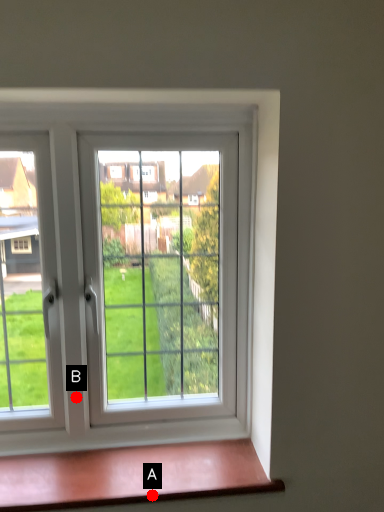
Question: Two points are circled on the image, labeled by A and B beside each circle. Which point appears closest to the camera in this image?

Choices:
 (A) A is closer
 (B) B is closer

Answer: (A)